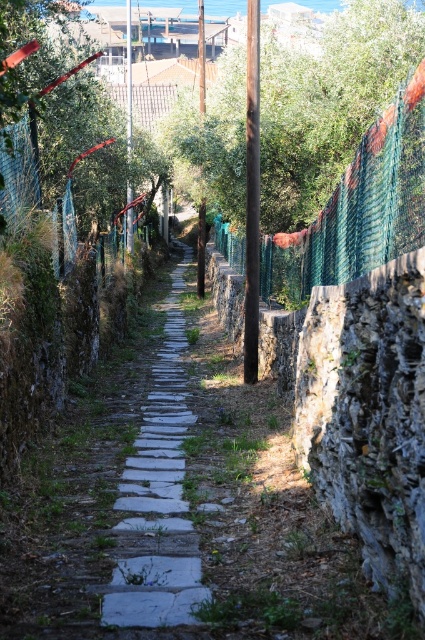
You are a gardener who needs to water plants along the white stone path at center. There is a green mesh fence at center nearby. How far apart are these two objects from each other?

The green mesh fence at center is 8.44 feet from the white stone path at center, so the distance between them is 8.44 feet.

You are standing on the pathway and want to walk towards the point labeled as point (198, 563). If you continue straight, will you eventually reach point (283, 285)?

No, because point (283, 285) is behind point (198, 563), so continuing straight towards point (198, 563) would move you away from point (283, 285).

You are a gardener walking along the white stone path at center and notice a green mesh fence at center. From your perspective, which object is closer to you?

The green mesh fence at center is positioned over the white stone path at center, so it is closer to you.